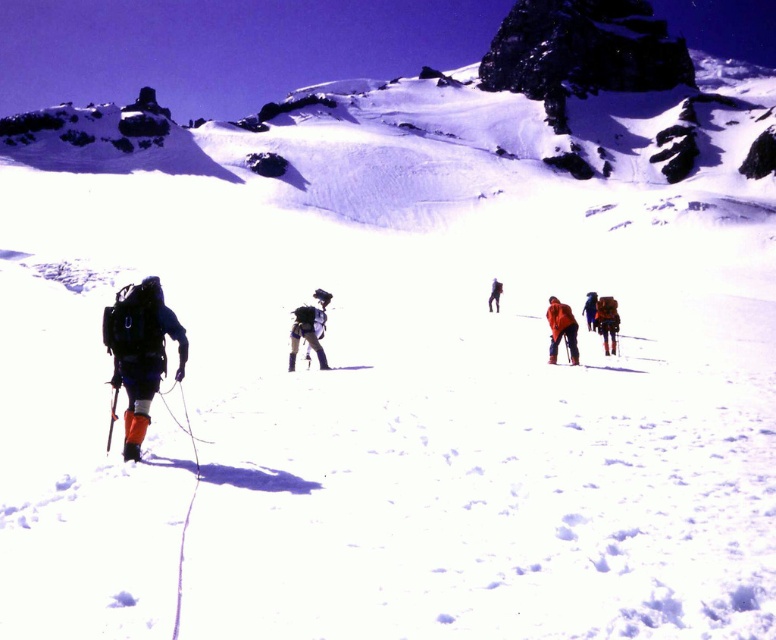
You are a climber planning to reach the summit. You see the snowy rock at upper center and the matte black backpack at center. Which object is higher up the mountain?

The snowy rock at upper center is positioned over the matte black backpack at center, so it is higher up the mountain.

You are a climber planning to reach the summit. You see the snowy rock at upper center and the matte black backpack at center. How far apart are these two landmarks from each other?

The snowy rock at upper center and the matte black backpack at center are 426.84 feet apart from each other.